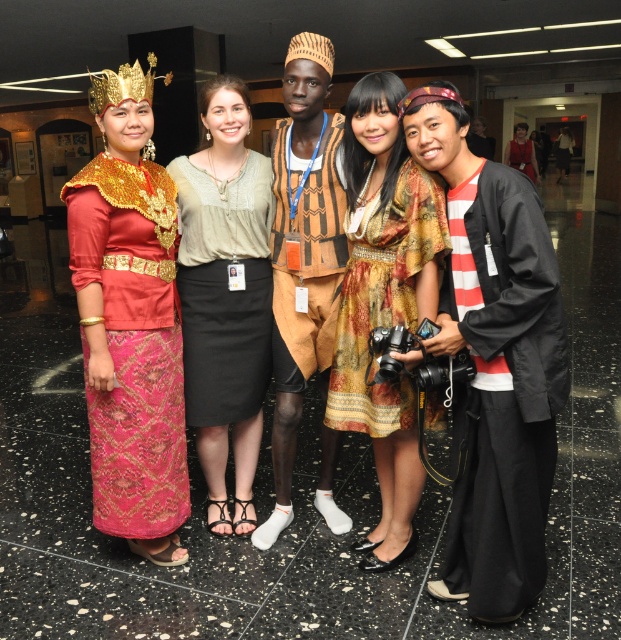
Is black matte robe at right below printed fabric dress at center?

Correct, black matte robe at right is located below printed fabric dress at center.

Describe the element at coordinates (505, 394) in the screenshot. Image resolution: width=621 pixels, height=640 pixels. I see `black matte robe at right` at that location.

Measure the distance between black matte robe at right and camera.

black matte robe at right is 5.23 feet from camera.

The width and height of the screenshot is (621, 640). Identify the location of black matte robe at right. (505, 394).

Can you confirm if matte gold crown at upper left is taller than printed fabric dress at center?

Indeed, matte gold crown at upper left has a greater height compared to printed fabric dress at center.

Can you confirm if matte gold crown at upper left is shorter than printed fabric dress at center?

Incorrect, matte gold crown at upper left's height does not fall short of printed fabric dress at center's.

The image size is (621, 640). Find the location of `matte gold crown at upper left`. matte gold crown at upper left is located at coordinates (130, 323).

I want to click on matte gold crown at upper left, so click(x=130, y=323).

Which is in front, point (206, 468) or point (397, 394)?

Point (397, 394) is more forward.

Can you confirm if light beige textured blouse at center is positioned below printed fabric dress at center?

No.

Is point (245, 163) behind point (392, 387)?

Yes, point (245, 163) is behind point (392, 387).

This screenshot has height=640, width=621. I want to click on light beige textured blouse at center, so click(225, 298).